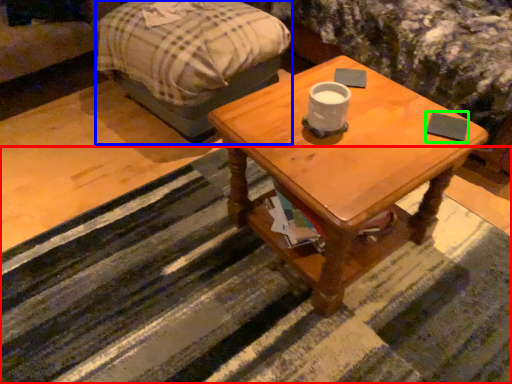
Question: Estimate the real-world distances between objects in this image. Which object is closer to strip (highlighted by a red box), bed frame (highlighted by a blue box) or pad (highlighted by a green box)?

Choices:
 (A) bed frame
 (B) pad

Answer: (A)